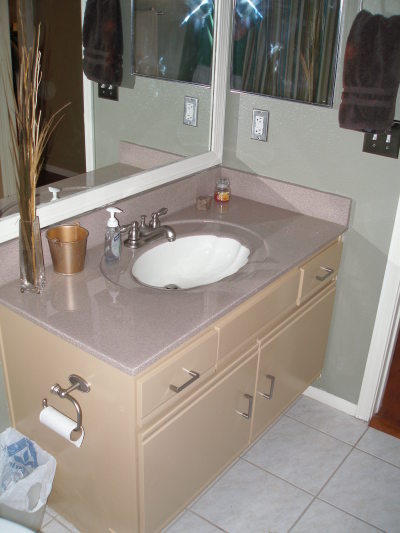
At what (x,y) coordinates should I click in order to perform the action: click on cabinets. Please return your answer as a coordinate pair (x, y). The image size is (400, 533). Looking at the image, I should click on point(227,419), point(295,355).